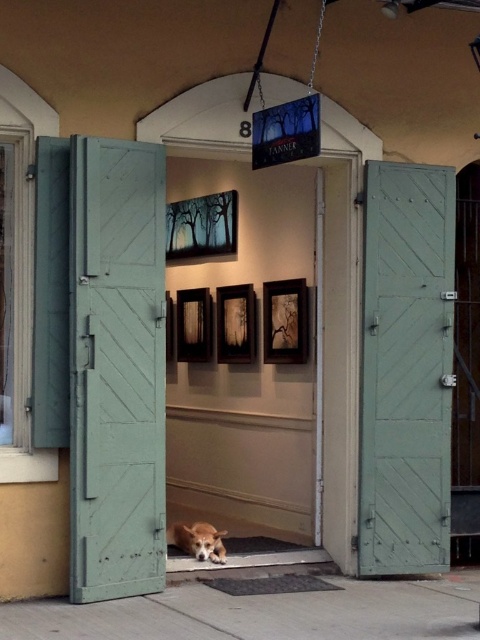
Question: Is teal wood door at left behind green wood door at right?

Choices:
 (A) no
 (B) yes

Answer: (A)

Question: Among these points, which one is nearest to the camera?

Choices:
 (A) (171, 540)
 (B) (129, 403)

Answer: (B)

Question: Which point is farther from the camera taking this photo?

Choices:
 (A) (122, 566)
 (B) (451, 378)
 (C) (214, 548)

Answer: (B)

Question: Is teal wood door at left below brown fur dog at center?

Choices:
 (A) no
 (B) yes

Answer: (A)

Question: Considering the relative positions of green wood door at right and brown fur dog at center in the image provided, where is green wood door at right located with respect to brown fur dog at center?

Choices:
 (A) right
 (B) left

Answer: (A)

Question: Which object is closer to the camera taking this photo?

Choices:
 (A) brown fur dog at center
 (B) green wood door at right
 (C) teal wood door at left

Answer: (C)